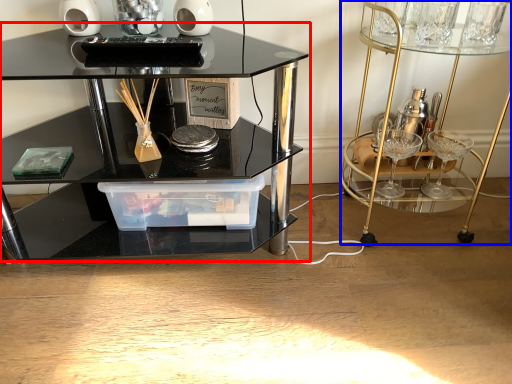
Question: Which object appears closest to the camera in this image, table (highlighted by a red box) or vanity (highlighted by a blue box)?

Choices:
 (A) table
 (B) vanity

Answer: (A)